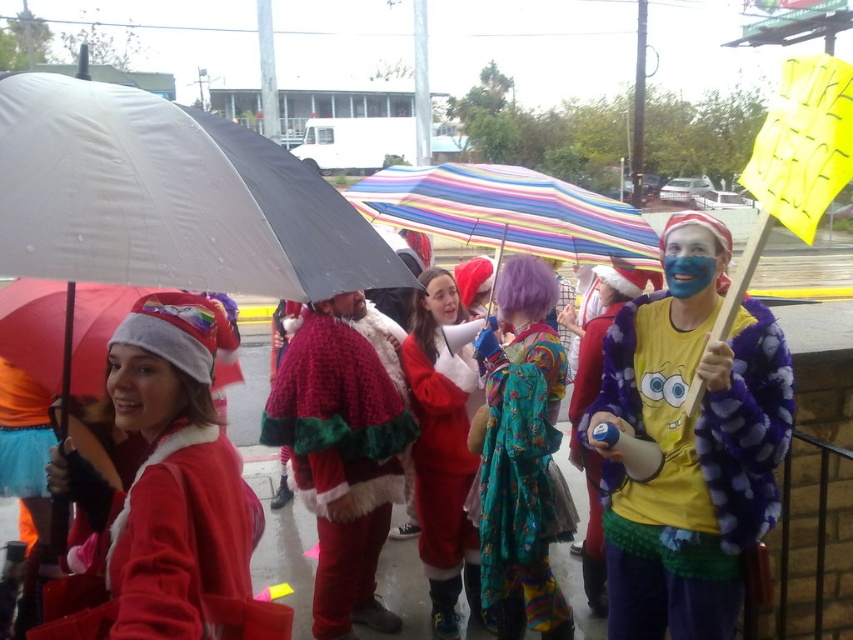
The height and width of the screenshot is (640, 853). Describe the element at coordinates (519, 481) in the screenshot. I see `multicolored fabric dress at center` at that location.

Between point (555, 348) and point (422, 179), which one is positioned in front?

Point (422, 179) is more forward.

Which is behind, point (490, 532) or point (488, 212)?

Point (490, 532)

Identify the location of multicolored fabric dress at center. (519, 481).

Can you confirm if velvet santa suit at center is wider than multicolored fabric dress at center?

Yes, velvet santa suit at center is wider than multicolored fabric dress at center.

Does velvet santa suit at center lie behind multicolored fabric dress at center?

No, velvet santa suit at center is closer to the viewer.

Who is more forward, (146, 605) or (509, 541)?

Positioned in front is point (146, 605).

Locate an element on the screen. The width and height of the screenshot is (853, 640). velvet santa suit at center is located at coordinates (172, 556).

Measure the distance between velvet santa suit at center and velvet-like red santa suit at center.

velvet santa suit at center is 4.68 feet from velvet-like red santa suit at center.

Which is more to the left, velvet santa suit at center or velvet-like red santa suit at center?

velvet santa suit at center

Is point (262, 611) closer to viewer compared to point (387, 420)?

Yes, it is in front of point (387, 420).

At what (x,y) coordinates should I click in order to perform the action: click on velvet santa suit at center. Please return your answer as a coordinate pair (x, y). Looking at the image, I should click on (172, 556).